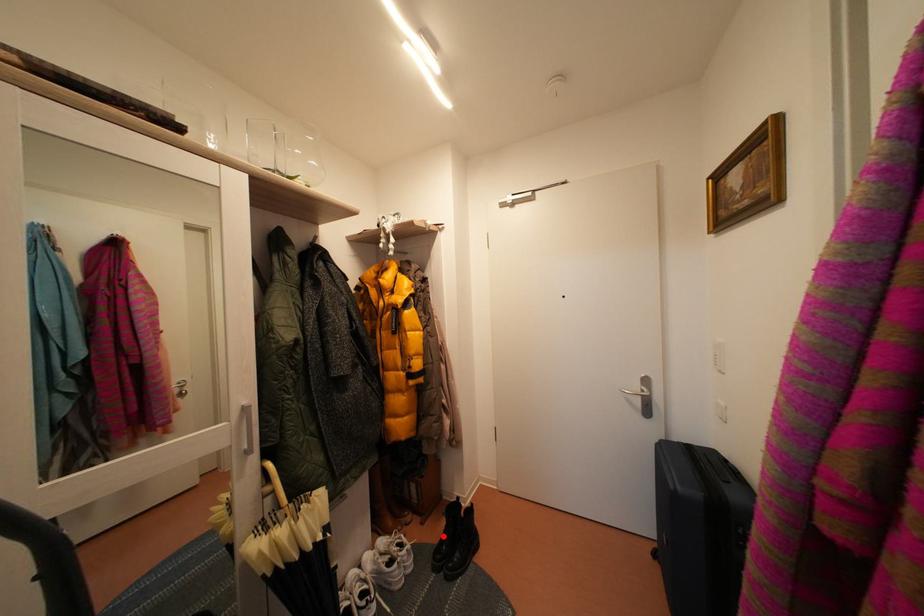
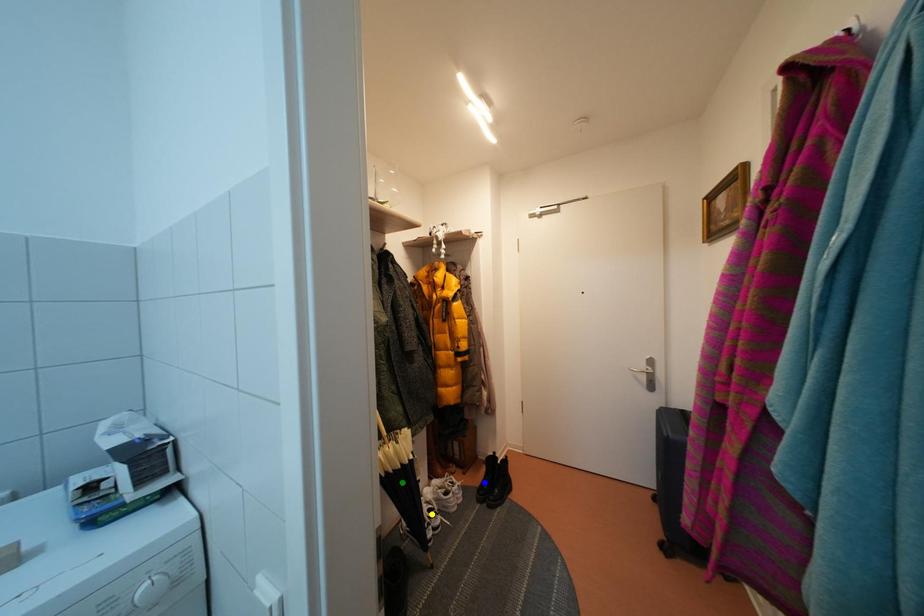
Question: I am providing you with two images of the same scene from different viewpoints. A red point is marked on the first image. You are given multiple points on the second image. Which point in image 2 represents the same 3d spot as the red point in image 1?

Choices:
 (A) blue point
 (B) green point
 (C) yellow point

Answer: (A)